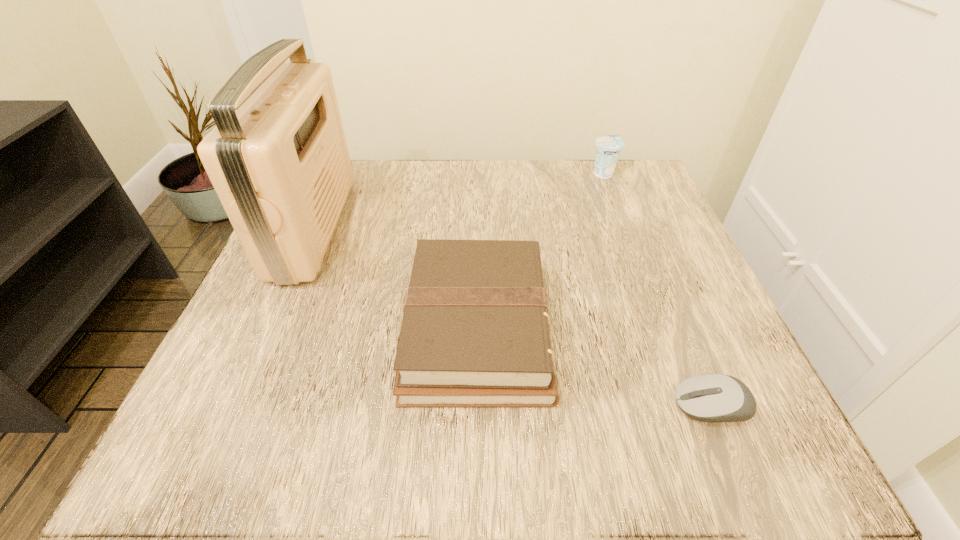
At what (x,y) coordinates should I click in order to perform the action: click on free point located 0.390m on the wheel side of the computer equipment. Please return your answer as a coordinate pair (x, y). The width and height of the screenshot is (960, 540). Looking at the image, I should click on (394, 406).

The height and width of the screenshot is (540, 960). I want to click on radio receiver located at the far edge, so click(x=278, y=159).

This screenshot has height=540, width=960. I want to click on yogurt located at the far edge, so click(608, 148).

The width and height of the screenshot is (960, 540). Find the location of `Bible at the near edge`. Bible at the near edge is located at coordinates point(475,332).

This screenshot has width=960, height=540. Find the location of `computer equipment positioned at the near edge`. computer equipment positioned at the near edge is located at coordinates (711, 397).

Identify the location of object present at the left edge. Image resolution: width=960 pixels, height=540 pixels. coord(278,159).

Identify the location of yogurt at the right edge. (608, 148).

Where is `computer equipment at the right edge`? The width and height of the screenshot is (960, 540). computer equipment at the right edge is located at coordinates (711, 397).

In order to click on object present at the far left corner in this screenshot , I will do `click(278, 159)`.

Where is `object that is at the far right corner`? The height and width of the screenshot is (540, 960). object that is at the far right corner is located at coordinates coord(608,148).